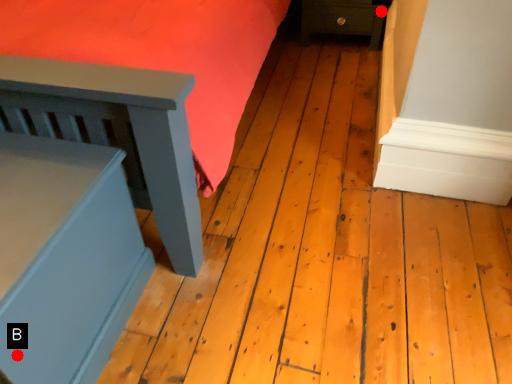
Question: Two points are circled on the image, labeled by A and B beside each circle. Which point is further to the camera?

Choices:
 (A) A is further
 (B) B is further

Answer: (A)